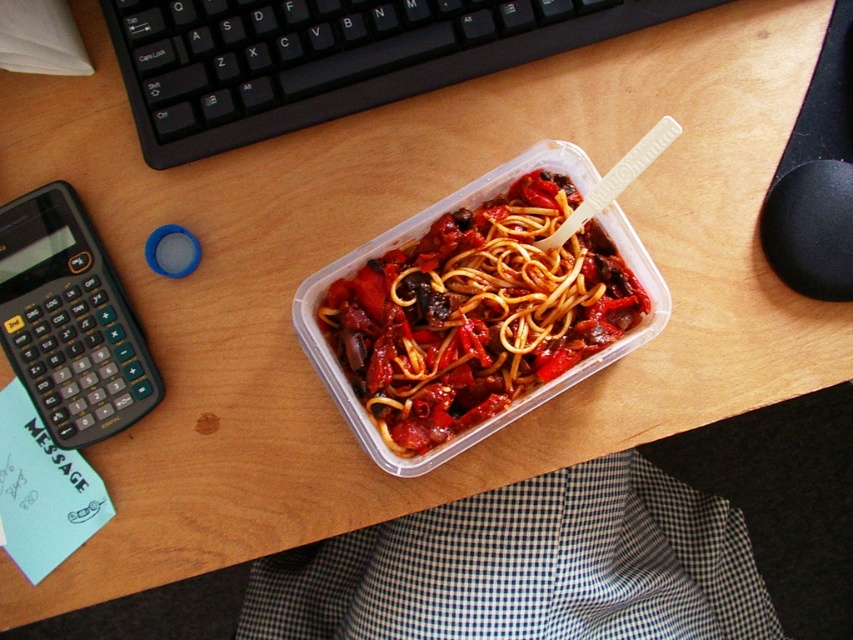
Between point (364, 28) and point (35, 326), which one is positioned behind?

Point (364, 28)

Which is below, black plastic keyboard at upper center or black plastic calculator at left?

black plastic calculator at left is lower down.

Locate an element on the screen. The width and height of the screenshot is (853, 640). black plastic keyboard at upper center is located at coordinates (328, 56).

Where is `black plastic keyboard at upper center`? black plastic keyboard at upper center is located at coordinates (328, 56).

Can you confirm if black plastic keyboard at upper center is taller than translucent plastic container at center?

No.

Is black plastic keyboard at upper center to the left of translucent plastic container at center from the viewer's perspective?

Correct, you'll find black plastic keyboard at upper center to the left of translucent plastic container at center.

Which is in front, point (440, 77) or point (416, 403)?

Point (416, 403)

Where is `black plastic keyboard at upper center`? The image size is (853, 640). black plastic keyboard at upper center is located at coordinates (328, 56).

Does translucent plastic container at center have a lesser height compared to black plastic calculator at left?

No, translucent plastic container at center is not shorter than black plastic calculator at left.

Is point (358, 356) positioned behind point (80, 333)?

No, it is in front of (80, 333).

Where is `translucent plastic container at center`? The image size is (853, 640). translucent plastic container at center is located at coordinates (477, 312).